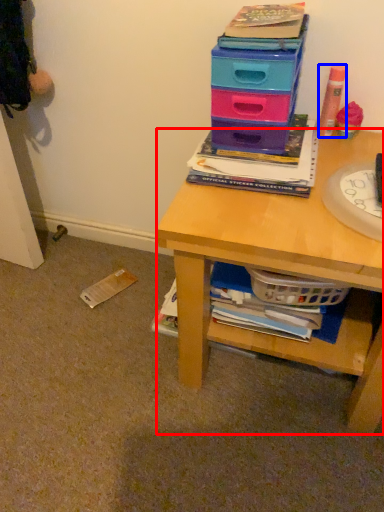
Question: Which point is further to the camera, desk (highlighted by a red box) or stationery (highlighted by a blue box)?

Choices:
 (A) desk
 (B) stationery

Answer: (B)